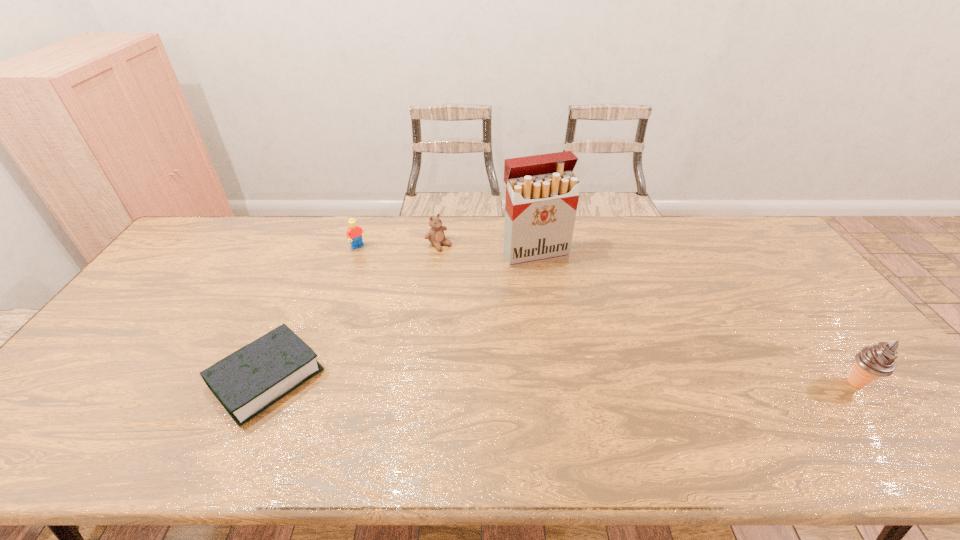
The width and height of the screenshot is (960, 540). In order to click on vacant space in between the cigarette case and the teddy bear in this screenshot , I will do `click(487, 249)`.

Select which object appears as the third closest to the third object from left to right. Please provide its 2D coordinates. Your answer should be formatted as a tuple, i.e. [(x, y)], where the tuple contains the x and y coordinates of a point satisfying the conditions above.

[(248, 381)]

The height and width of the screenshot is (540, 960). Find the location of `object that can be found as the third closest to the rightmost object`. object that can be found as the third closest to the rightmost object is located at coordinates (248, 381).

Where is `vacant region that satisfies the following two spatial constraints: 1. on the back side of the teddy bear; 2. on the right side of the Lego`? vacant region that satisfies the following two spatial constraints: 1. on the back side of the teddy bear; 2. on the right side of the Lego is located at coordinates (360, 245).

Locate an element on the screen. Image resolution: width=960 pixels, height=540 pixels. vacant position in the image that satisfies the following two spatial constraints: 1. on the front side of the rightmost object; 2. on the left side of the Lego is located at coordinates click(x=313, y=383).